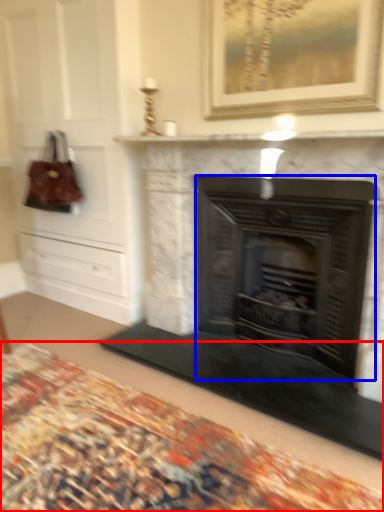
Question: Which of the following is the closest to the observer, plain (highlighted by a red box) or fireplace (highlighted by a blue box)?

Choices:
 (A) plain
 (B) fireplace

Answer: (A)